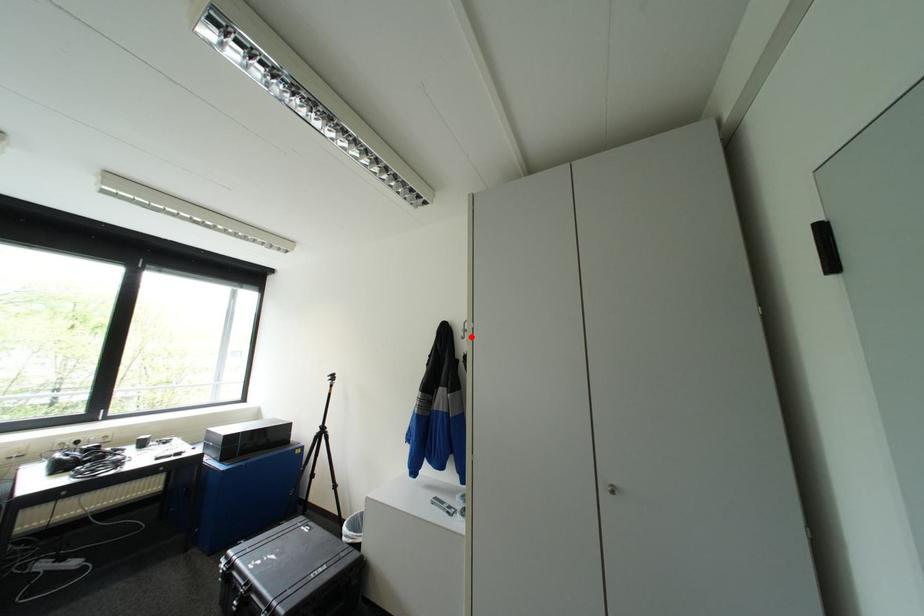
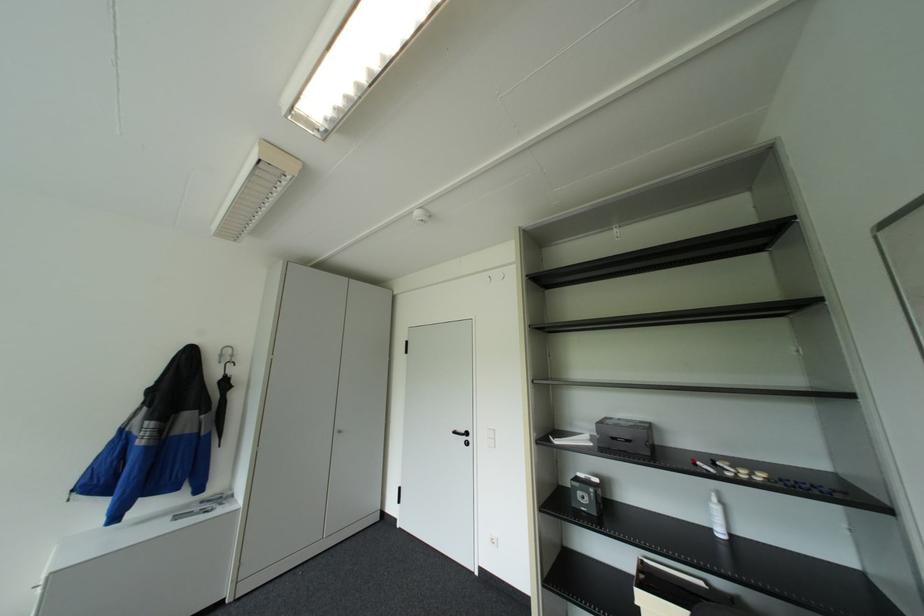
Where in the second image is the point corresponding to the highlighted location from the first image?

(227, 361)